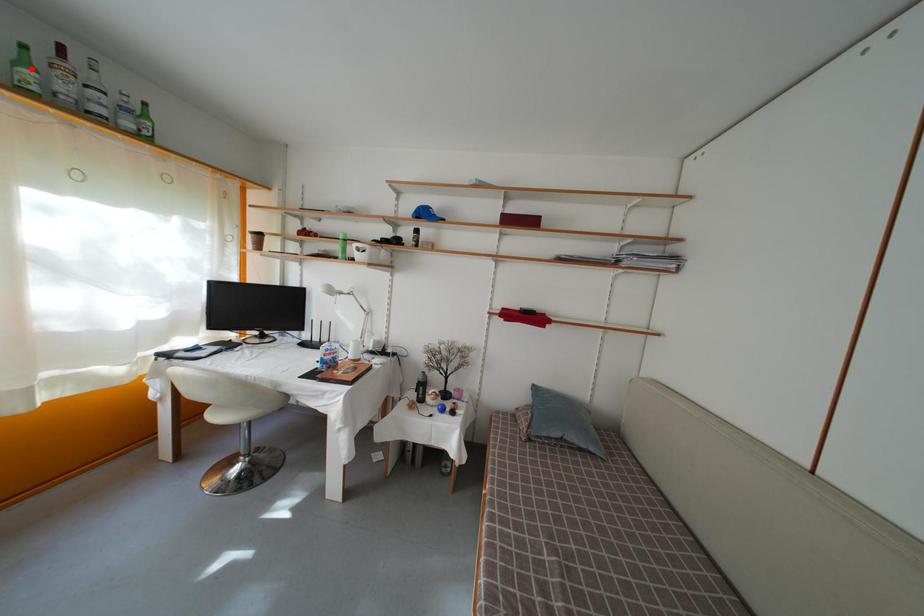
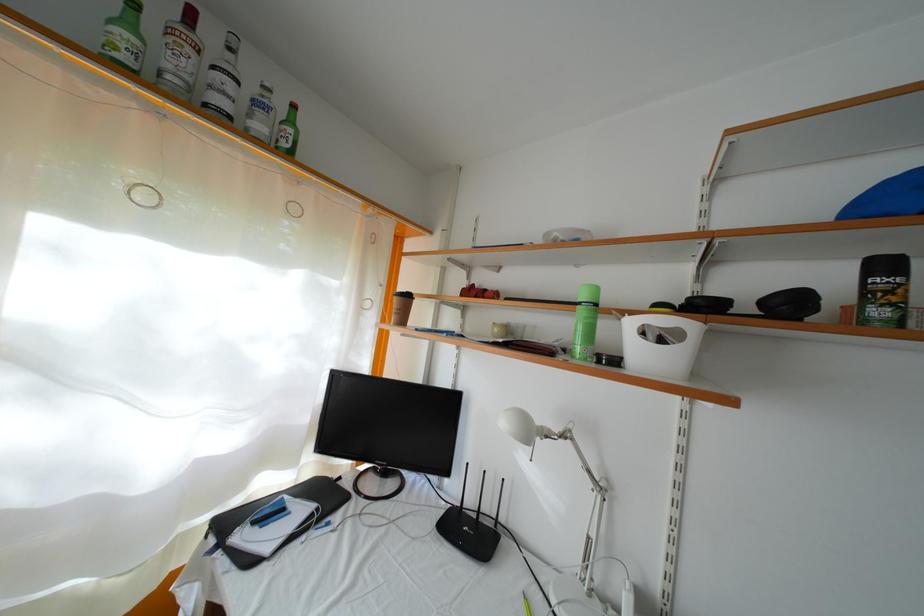
Find the pixel in the second image that matches the highlighted location in the first image.

(134, 31)